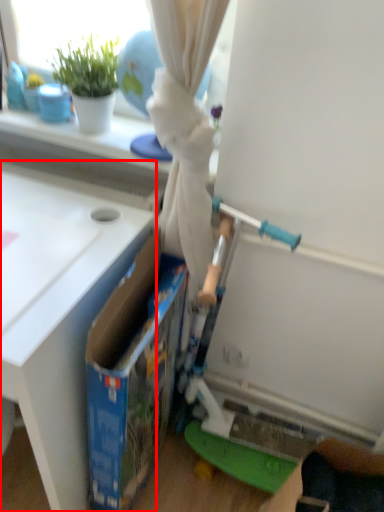
Question: From the image's perspective, where is table (annotated by the red box) located relative to storage box?

Choices:
 (A) below
 (B) above

Answer: (B)